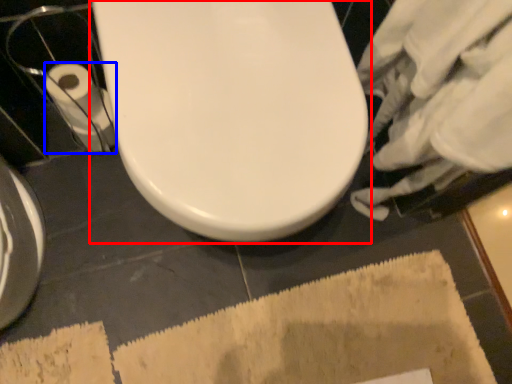
Question: Among these objects, which one is nearest to the camera, toilet (highlighted by a red box) or toilet paper (highlighted by a blue box)?

Choices:
 (A) toilet
 (B) toilet paper

Answer: (A)